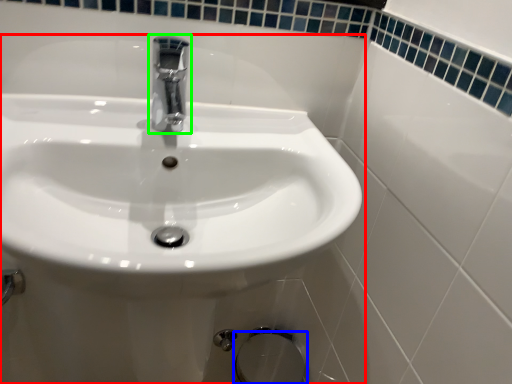
Question: Estimate the real-world distances between objects in this image. Which object is closer to sink (highlighted by a red box), bidet (highlighted by a blue box) or tap (highlighted by a green box)?

Choices:
 (A) bidet
 (B) tap

Answer: (B)